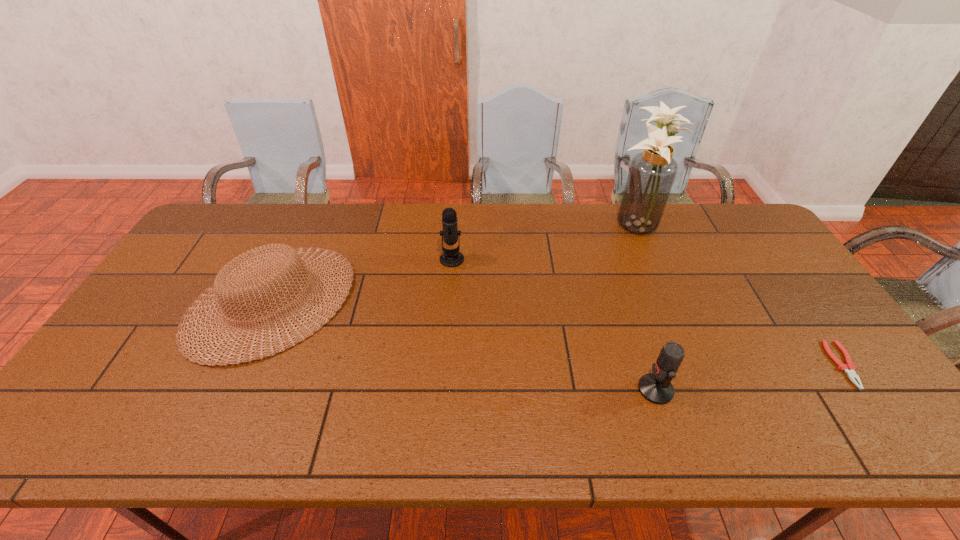
Find the location of `vacant area that lies between the tallest object and the shortest object`. vacant area that lies between the tallest object and the shortest object is located at coordinates (739, 294).

Identify the location of free space between the nearer microphone and the pliers. (750, 377).

Locate an element on the screen. vacant region between the second tallest object and the second shortest object is located at coordinates (362, 280).

Identify which object is the fourth nearest to the second object from left to right. Please provide its 2D coordinates. Your answer should be formatted as a tuple, i.e. [(x, y)], where the tuple contains the x and y coordinates of a point satisfying the conditions above.

[(849, 368)]

Point out which object is positioned as the third nearest to the leftmost object. Please provide its 2D coordinates. Your answer should be formatted as a tuple, i.e. [(x, y)], where the tuple contains the x and y coordinates of a point satisfying the conditions above.

[(652, 172)]

At what (x,y) coordinates should I click in order to perform the action: click on free space that satisfies the following two spatial constraints: 1. on the front side of the sunhat; 2. on the right side of the pliers. Please return your answer as a coordinate pair (x, y). Looking at the image, I should click on 242,365.